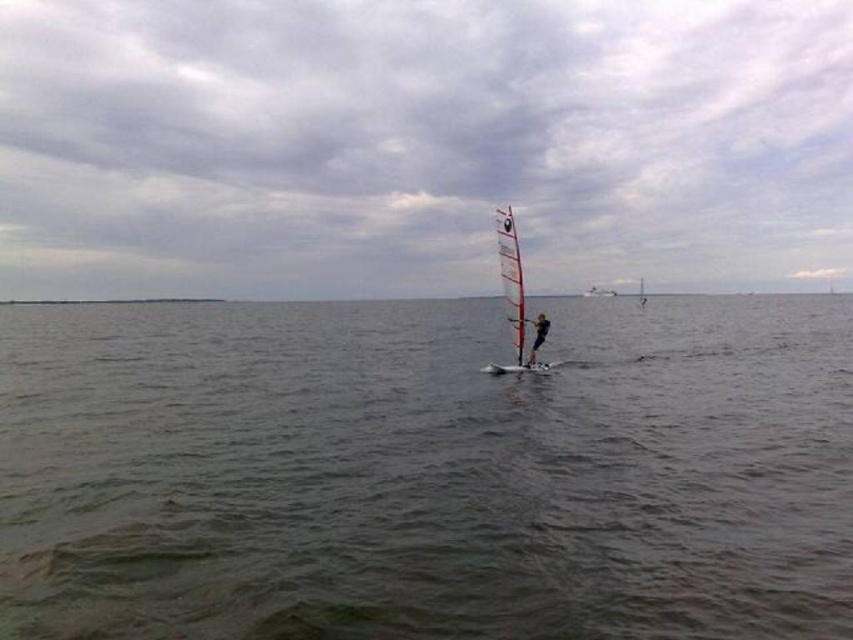
Does white glossy sail at center appear over black fabric windsurfer at center?

Correct, white glossy sail at center is located above black fabric windsurfer at center.

Between white glossy sail at center and black fabric windsurfer at center, which one appears on the left side from the viewer's perspective?

white glossy sail at center is more to the left.

Identify the location of white glossy sail at center. The width and height of the screenshot is (853, 640). (514, 298).

Can you confirm if greenish water at center is thinner than black fabric windsurfer at center?

In fact, greenish water at center might be wider than black fabric windsurfer at center.

Where is `greenish water at center`? This screenshot has height=640, width=853. greenish water at center is located at coordinates (426, 472).

Does greenish water at center have a greater width compared to white glossy sail at center?

Yes, greenish water at center is wider than white glossy sail at center.

Is point (299, 566) closer to viewer compared to point (514, 326)?

That is True.

Does point (720, 428) lie in front of point (500, 365)?

That is True.

The height and width of the screenshot is (640, 853). In order to click on greenish water at center in this screenshot , I will do `click(426, 472)`.